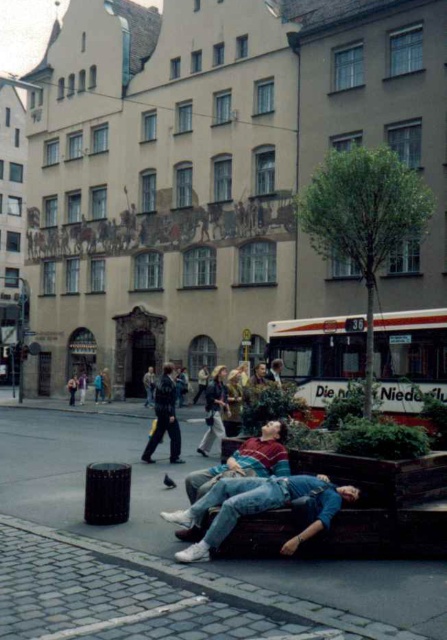
You are standing at the point marked by the coordinates point (245, 460) in the image. Looking around, you see a large ornate building with a mural and a group of people nearby. What color is the shirt of the person closest to you?

The point (245, 460) indicates matte red shirt at center, so the closest person to you is wearing a matte red shirt.

You are standing in the urban street scene and want to determine which of the two points, point (71, 461) or point (176, 397), is closer to you. Based on the scene, which point is nearer?

Point (71, 461) is closer to you because it is further to the viewer than point (176, 397).

In the scene shown: You are a photographer trying to capture a clear shot of the matte red shirt at center and the denim jacket at center. Since you want both subjects to be in focus, which one should you focus on first to ensure the other is also sharp?

You should focus on the matte red shirt at center first because it is in front of the denim jacket at center, so focusing on the closer subject will help keep both in focus.